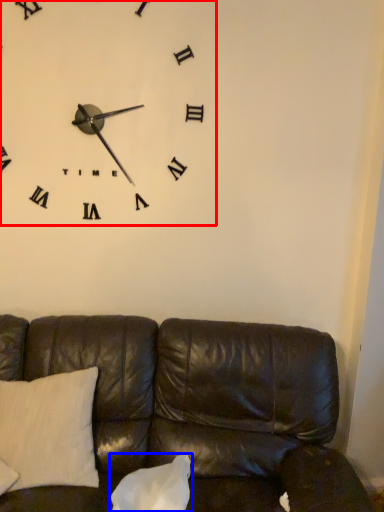
Question: Which point is closer to the camera, wall clock (highlighted by a red box) or pillow (highlighted by a blue box)?

Choices:
 (A) wall clock
 (B) pillow

Answer: (B)